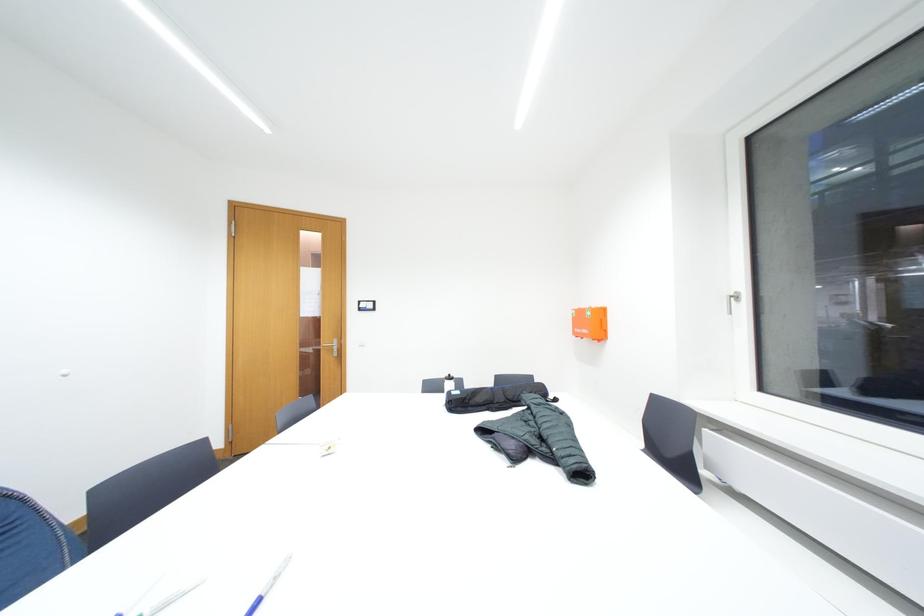
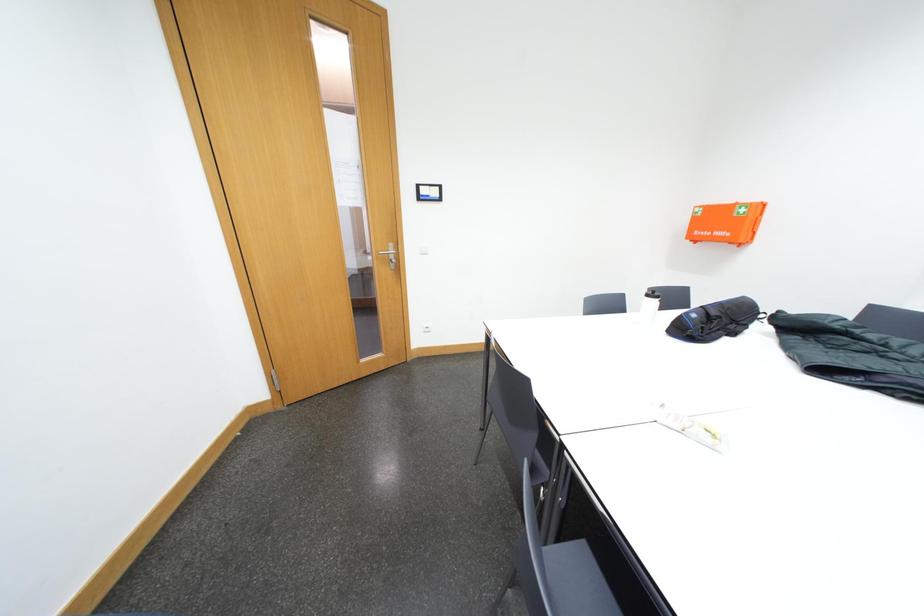
The images are taken continuously from a first-person perspective. In which direction are you moving?

The cameraman walked toward left, forward.